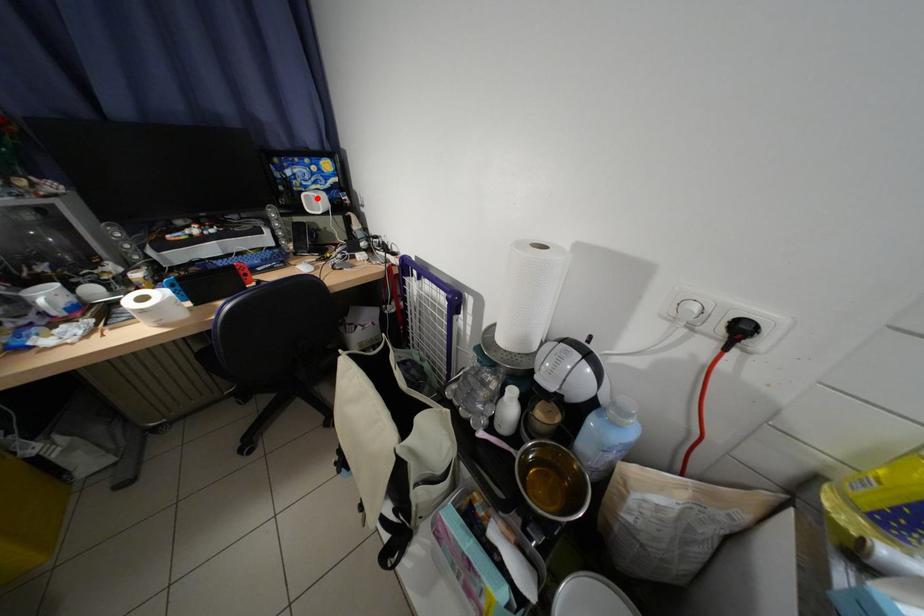
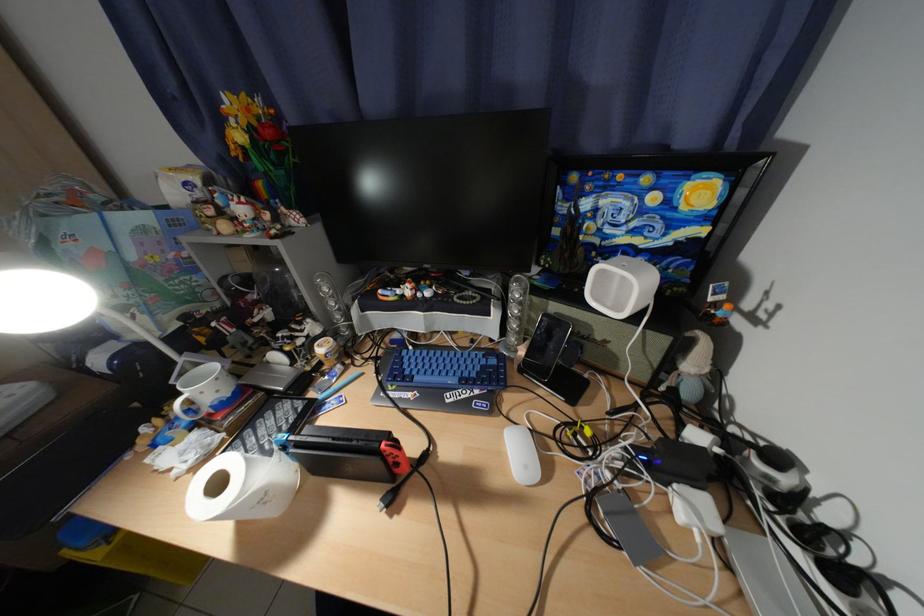
The point at the highlighted location is marked in the first image. Where is the corresponding point in the second image?

(613, 273)